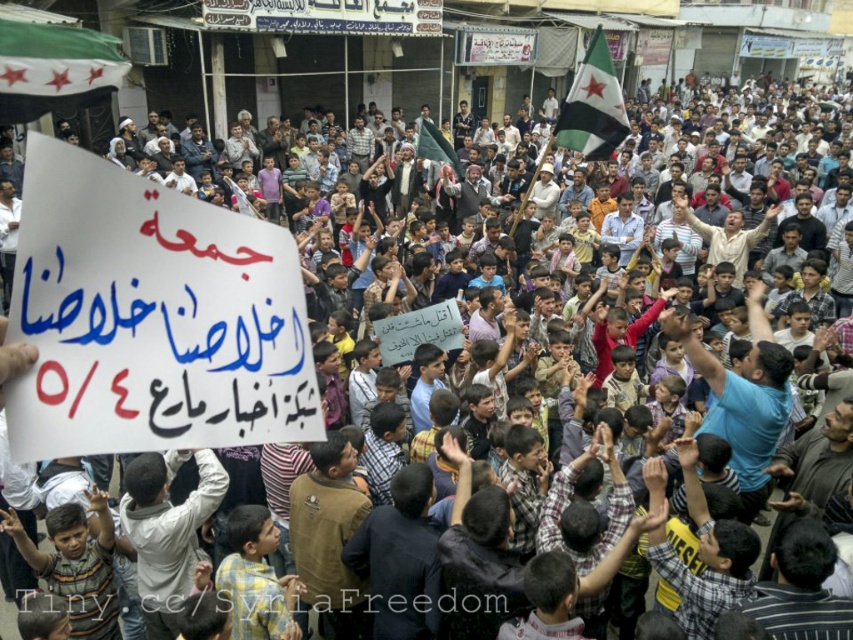
You are a journalist trying to document the protest. You notice a white fabric flag at upper left. Where exactly is this flag positioned in the image?

The white fabric flag at upper left is located at point (54, 68) in the image coordinates.